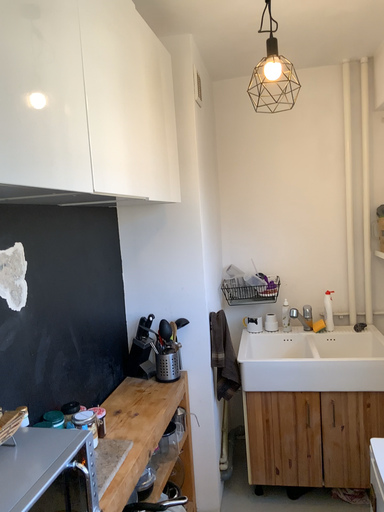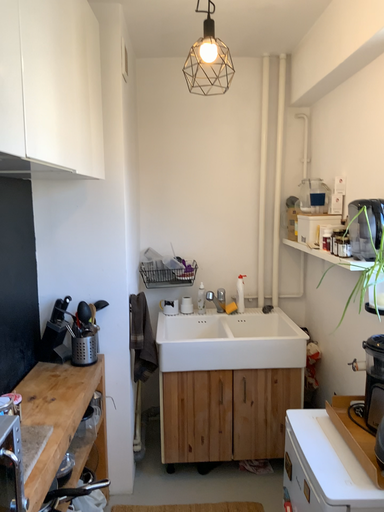
Question: How did the camera likely rotate when shooting the video?

Choices:
 (A) rotated left
 (B) rotated right

Answer: (B)